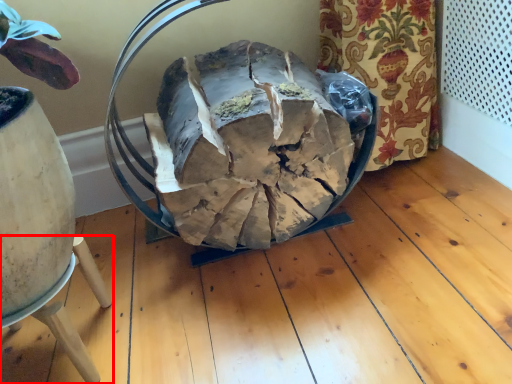
Question: Where is furniture (annotated by the red box) located in relation to food in the image?

Choices:
 (A) left
 (B) right

Answer: (A)